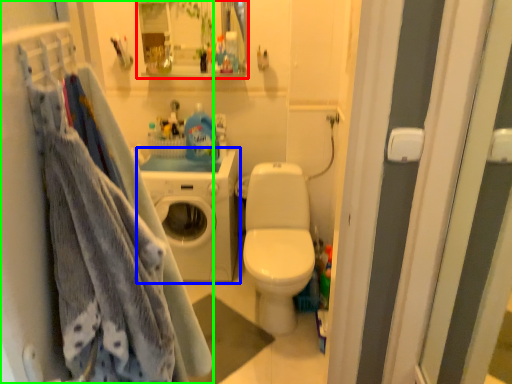
Question: Which is nearer to the cabinet (highlighted by a red box)? washing machine (highlighted by a blue box) or closet (highlighted by a green box).

Choices:
 (A) washing machine
 (B) closet

Answer: (A)